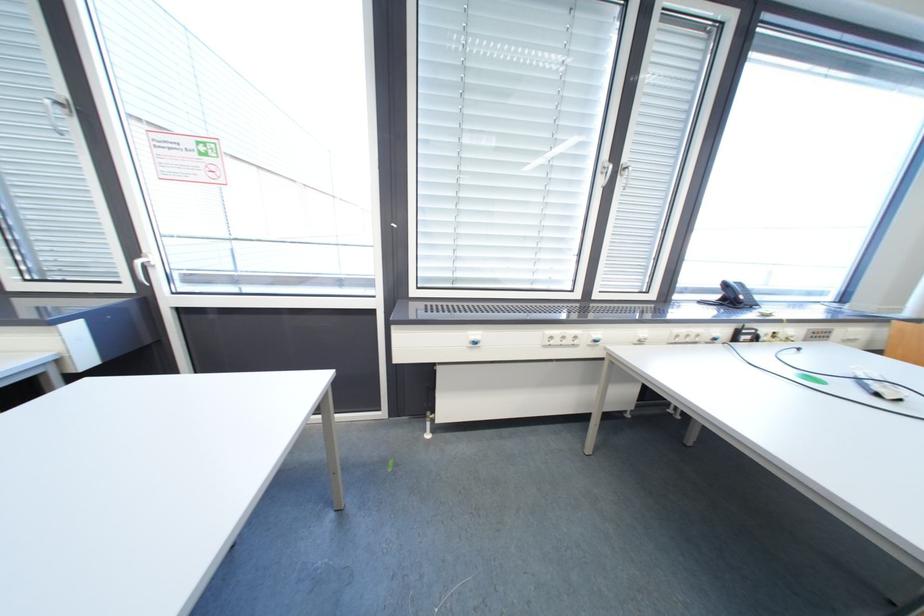
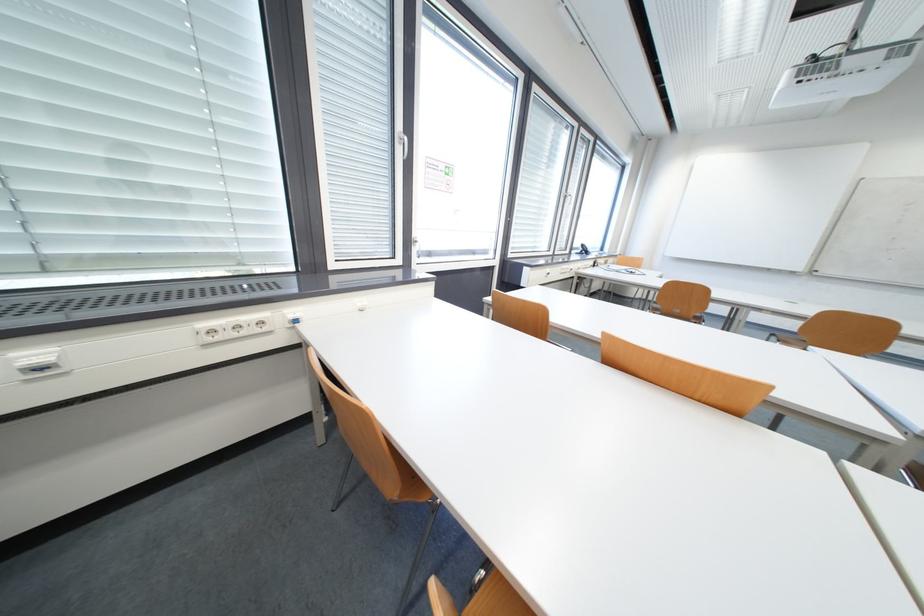
Locate, in the second image, the point that corresponds to point (730, 286) in the first image.

(588, 246)